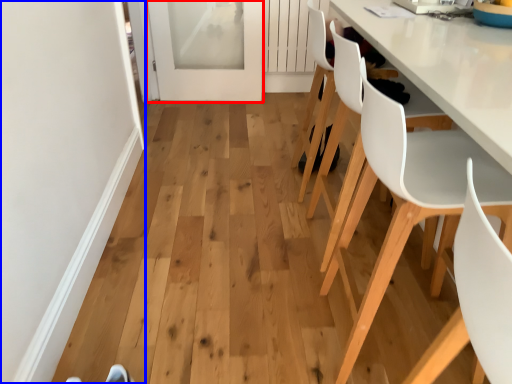
Question: Which object is further to the camera taking this photo, screen door (highlighted by a red box) or door (highlighted by a blue box)?

Choices:
 (A) screen door
 (B) door

Answer: (A)